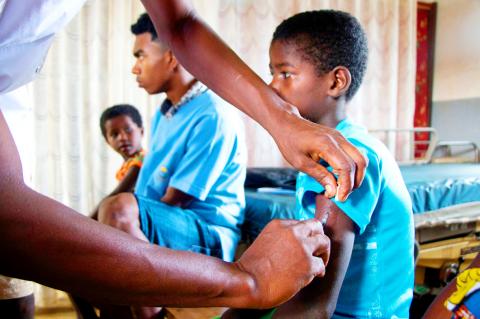
Find the location of `gurney`. gurney is located at coordinates (444, 180).